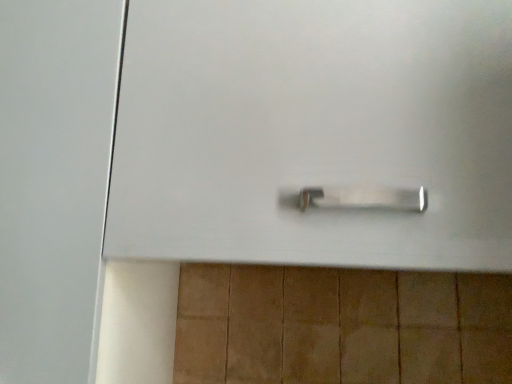
You are a GUI agent. You are given a task and a screenshot of the screen. Output one action in this format:
    pyautogui.click(x=<x>, y=<y>)
    Task: Click on the satin silver handle at center
    The image size is (512, 384).
    Given the screenshot: What is the action you would take?
    pyautogui.click(x=314, y=131)

Describe the element at coordinates (314, 131) in the screenshot. This screenshot has width=512, height=384. I see `satin silver handle at center` at that location.

Image resolution: width=512 pixels, height=384 pixels. I want to click on satin silver handle at center, so click(x=314, y=131).